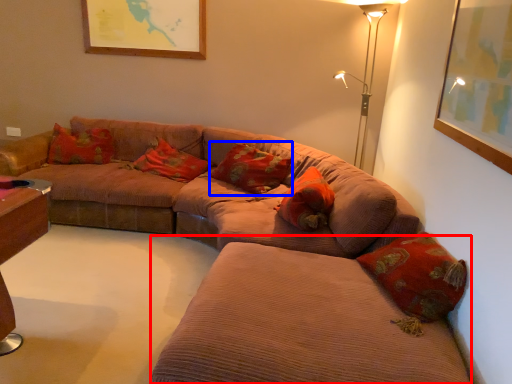
Question: Which object appears closest to the camera in this image, couch (highlighted by a red box) or pillow (highlighted by a blue box)?

Choices:
 (A) couch
 (B) pillow

Answer: (A)